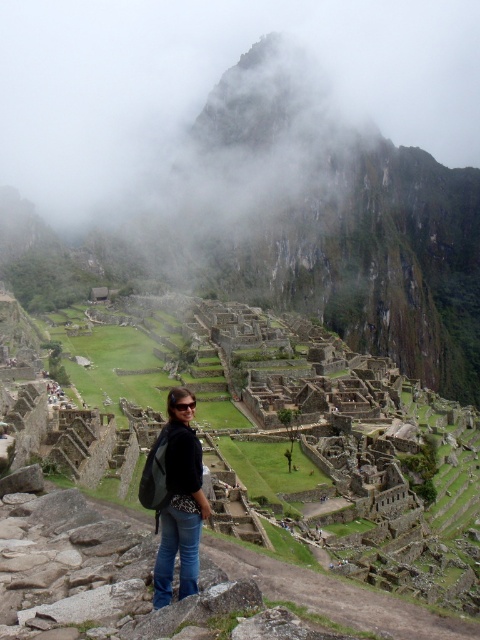
You are a photographer planning to capture a wide shot of the foggy misty mountain peak at upper center and the denim jeans at center. Given that the mountain peak is wider than the jeans, how should you adjust your camera frame to include both subjects properly?

Since the foggy misty mountain peak at upper center is wider than the denim jeans at center, you should position the camera frame to give more horizontal space to the mountain peak while ensuring the denim jeans at center remains centered within the shot.

You are a photographer at Machu Picchu trying to capture a clear shot of the denim jeans at center without the foggy misty mountain peak at upper center blocking the view. Is this possible?

The denim jeans at center is behind the foggy misty mountain peak at upper center, so the mountain peak will block the view of the jeans. To capture the jeans clearly, you need to move to a position where the mountain peak is not in front of them.

Consider the image. You are a tour guide at Machu Picchu and want to direct a visitor to a point that is closer to the camera. Which of the two points, point (382, 74) or point (194, 432), should they move towards?

The visitor should move towards point (194, 432) because it is closer to the camera than point (382, 74).